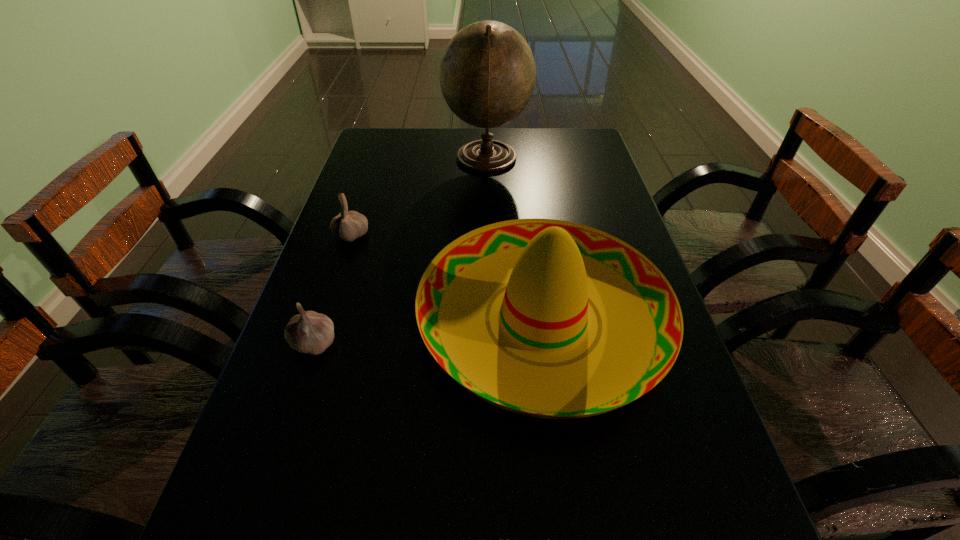
Where is `the tallest object`? the tallest object is located at coordinates (487, 74).

This screenshot has width=960, height=540. I want to click on globe, so pyautogui.click(x=487, y=74).

The height and width of the screenshot is (540, 960). In order to click on sombrero in this screenshot , I will do `click(547, 318)`.

I want to click on the nearer garlic, so click(x=309, y=332).

Image resolution: width=960 pixels, height=540 pixels. I want to click on the farther garlic, so click(x=350, y=225).

Where is `vacant space located on the front-facing side of the globe`? The height and width of the screenshot is (540, 960). vacant space located on the front-facing side of the globe is located at coordinates pyautogui.click(x=394, y=159).

I want to click on vacant space situated on the front-facing side of the globe, so click(x=390, y=159).

Where is `free space located on the front-facing side of the globe`? free space located on the front-facing side of the globe is located at coordinates (396, 159).

This screenshot has height=540, width=960. What are the coordinates of `vacant space situated 0.090m on the left of the sombrero` in the screenshot? It's located at [x=376, y=318].

At what (x,y) coordinates should I click in order to perform the action: click on vacant space located on the right of the nearer garlic. Please return your answer as a coordinate pair (x, y). This screenshot has width=960, height=540. Looking at the image, I should click on (515, 342).